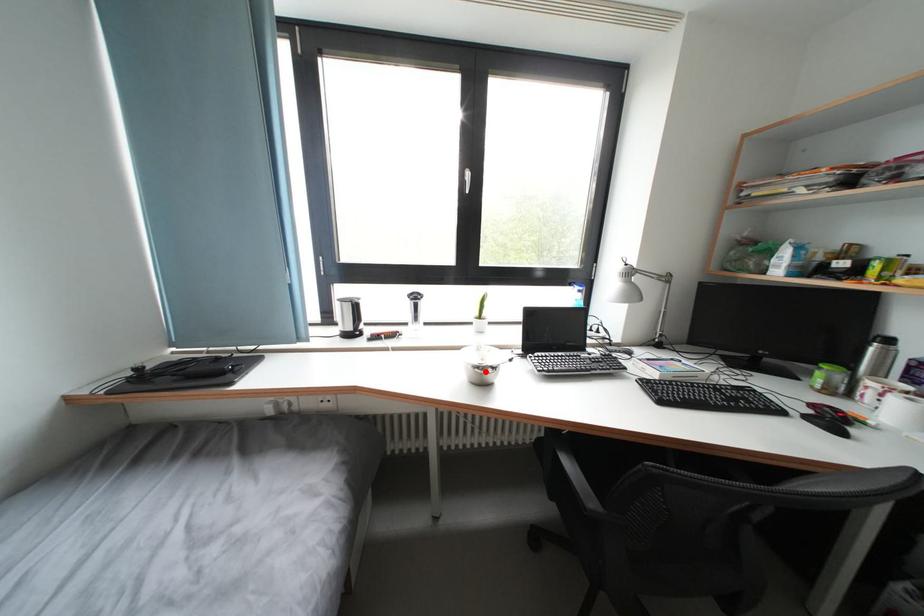
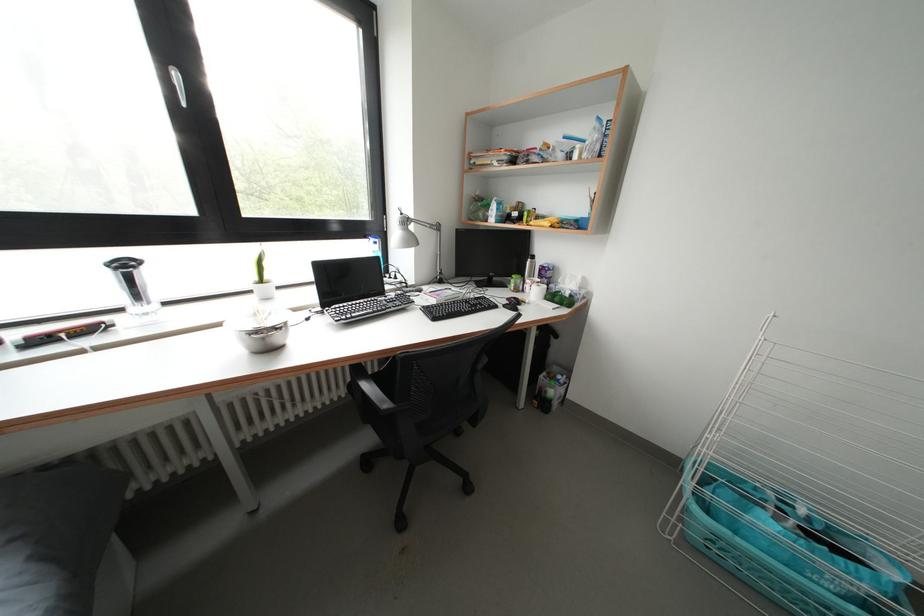
Where in the second image is the point corresponding to the highlighted location from the first image?

(262, 337)